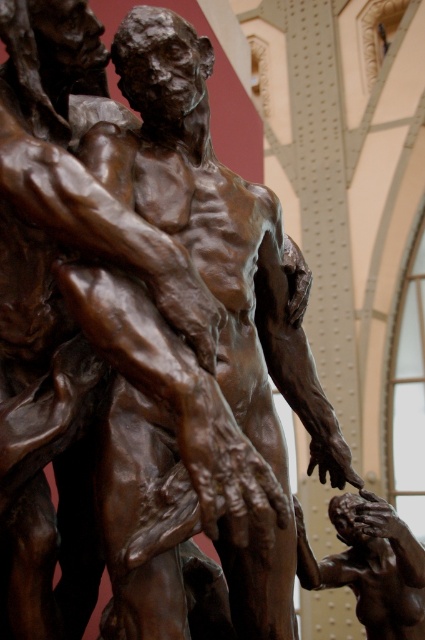
In the scene of the bronze sculpture, there are two main subjects, the bronze statue at center and the bronze figure at center. Which one is positioned higher in the image?

The bronze statue at center is positioned higher than the bronze figure at center.

You are an art critic analyzing the sculpture. You observe two points on the sculpture labeled as point (172, 342) and point (388, 588). Which point is positioned closer to your viewpoint?

Point (172, 342) is closer to the viewer than point (388, 588).

Based on the provided scene description, what are the coordinates of the bronze statue at center in the image?

The bronze statue at center is located at coordinates point (215, 236).